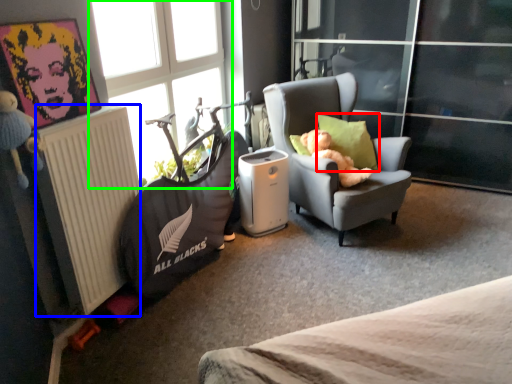
Question: Based on their relative distances, which object is nearer to pillow (highlighted by a red box)? Choose from radiator (highlighted by a blue box) and window (highlighted by a green box).

Choices:
 (A) radiator
 (B) window

Answer: (B)